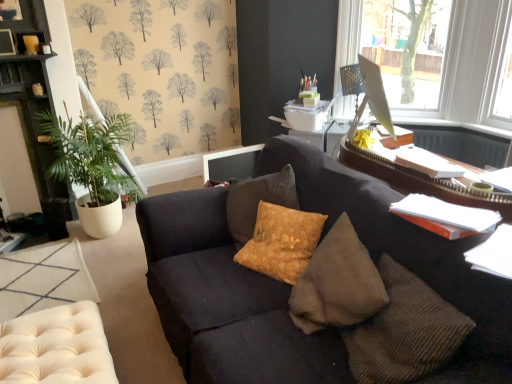
This screenshot has height=384, width=512. I want to click on vacant region above beige tufted ottoman at lower left (from a real-world perspective), so click(41, 277).